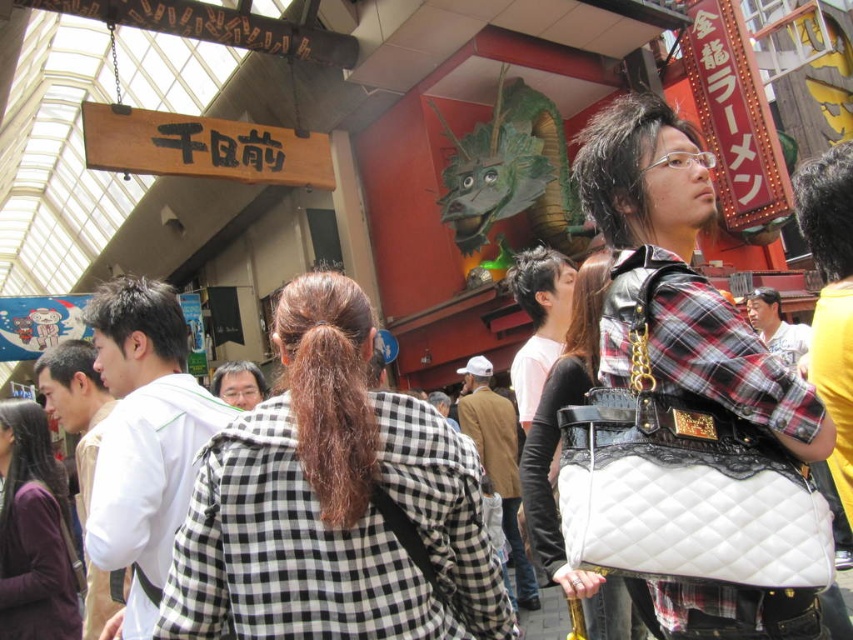
Is white quilted leather handbag at center taller than dark purple sweater at center?

Correct, white quilted leather handbag at center is much taller as dark purple sweater at center.

Does white quilted leather handbag at center appear on the right side of dark purple sweater at center?

Correct, you'll find white quilted leather handbag at center to the right of dark purple sweater at center.

The height and width of the screenshot is (640, 853). Describe the element at coordinates (556, 458) in the screenshot. I see `white quilted leather handbag at center` at that location.

Locate an element on the screen. The width and height of the screenshot is (853, 640). white quilted leather handbag at center is located at coordinates (556, 458).

How far apart are black checkered jacket at center and dark purple sweater at center?

18.93 meters

Is black checkered jacket at center positioned at the back of dark purple sweater at center?

No.

Which is behind, point (451, 586) or point (7, 570)?

The point (7, 570) is more distant.

Where is `black checkered jacket at center`? This screenshot has width=853, height=640. black checkered jacket at center is located at coordinates coord(334,502).

Does black checkered jacket at center appear over white quilted leather handbag at center?

Correct, black checkered jacket at center is located above white quilted leather handbag at center.

Locate an element on the screen. black checkered jacket at center is located at coordinates (334, 502).

Locate an element on the screen. black checkered jacket at center is located at coordinates (334, 502).